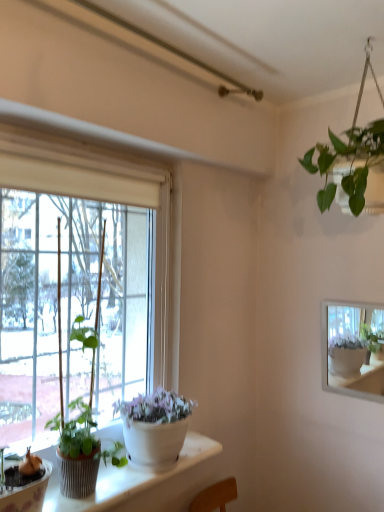
Looking at this image, what is the approximate height of green matte plant at left?

It is 32.85 inches.

What are the coordinates of `green matte plant at left` in the screenshot? It's located at (81, 452).

Describe the element at coordinates (81, 452) in the screenshot. This screenshot has height=512, width=384. I see `green matte plant at left` at that location.

This screenshot has width=384, height=512. What do you see at coordinates (96, 199) in the screenshot? I see `transparent glass window at left` at bounding box center [96, 199].

Find the location of `transparent glass window at left`. transparent glass window at left is located at coordinates (x=96, y=199).

Locate an element on the screen. This screenshot has height=512, width=384. green matte plant at left is located at coordinates (81, 452).

Is transparent glass window at left to the right of green matte plant at left from the viewer's perspective?

Yes, transparent glass window at left is to the right of green matte plant at left.

Considering the positions of objects transparent glass window at left and green matte plant at left in the image provided, who is behind, transparent glass window at left or green matte plant at left?

green matte plant at left.

Considering the points (138, 170) and (83, 448), which point is in front, point (138, 170) or point (83, 448)?

The point (83, 448) is closer to the camera.

From the image's perspective, between transparent glass window at left and green matte plant at left, which one is located above?

transparent glass window at left, from the image's perspective.

From a real-world perspective, is transparent glass window at left physically below green matte plant at left?

Incorrect, from a real-world perspective, transparent glass window at left is higher than green matte plant at left.

Can you confirm if transparent glass window at left is thinner than green matte plant at left?

No, transparent glass window at left is not thinner than green matte plant at left.

Considering the sizes of objects transparent glass window at left and green matte plant at left in the image provided, who is shorter, transparent glass window at left or green matte plant at left?

Standing shorter between the two is green matte plant at left.

Between transparent glass window at left and green matte plant at left, which one has smaller size?

With smaller size is green matte plant at left.

Can we say transparent glass window at left lies outside green matte plant at left?

Yes, transparent glass window at left is located beyond the bounds of green matte plant at left.

Consider the image. Is the surface of transparent glass window at left in direct contact with green matte plant at left?

transparent glass window at left and green matte plant at left are clearly separated.

Could you tell me if transparent glass window at left is turned towards green matte plant at left?

Yes, transparent glass window at left is aimed at green matte plant at left.

How different are the orientations of transparent glass window at left and green matte plant at left in degrees?

4.83 degrees separate the facing orientations of transparent glass window at left and green matte plant at left.

In order to click on houseplant below the transparent glass window at left (from a real-world perspective) in this screenshot , I will do click(x=81, y=452).

Is green matte plant at left at the right side of transparent glass window at left?

Incorrect, green matte plant at left is not on the right side of transparent glass window at left.

Who is more distant, green matte plant at left or transparent glass window at left?

Positioned behind is green matte plant at left.

Which is less distant, (x=88, y=452) or (x=50, y=152)?

The point (x=88, y=452) is closer to the camera.

From the image's perspective, is green matte plant at left positioned above or below transparent glass window at left?

Based on their image positions, green matte plant at left is located beneath transparent glass window at left.

From a real-world perspective, which is physically below, green matte plant at left or transparent glass window at left?

From a 3D spatial view, green matte plant at left is below.

Can you confirm if green matte plant at left is thinner than transparent glass window at left?

Indeed, green matte plant at left has a lesser width compared to transparent glass window at left.

Who is shorter, green matte plant at left or transparent glass window at left?

Standing shorter between the two is green matte plant at left.

Between green matte plant at left and transparent glass window at left, which one has larger size?

transparent glass window at left is bigger.

Would you say transparent glass window at left is part of green matte plant at left's contents?

Actually, transparent glass window at left is outside green matte plant at left.

Looking at this image, does green matte plant at left touch transparent glass window at left?

green matte plant at left is not next to transparent glass window at left, and they're not touching.

Based on the photo, is green matte plant at left positioned with its back to transparent glass window at left?

Yes, green matte plant at left is positioned with its back facing transparent glass window at left.

I want to click on window above the green matte plant at left (from the image's perspective), so click(96, 199).

Find the location of `window lying in front of the green matte plant at left`. window lying in front of the green matte plant at left is located at coordinates (96, 199).

The height and width of the screenshot is (512, 384). Identify the location of houseplant that is below the transparent glass window at left (from the image's perspective). (81, 452).